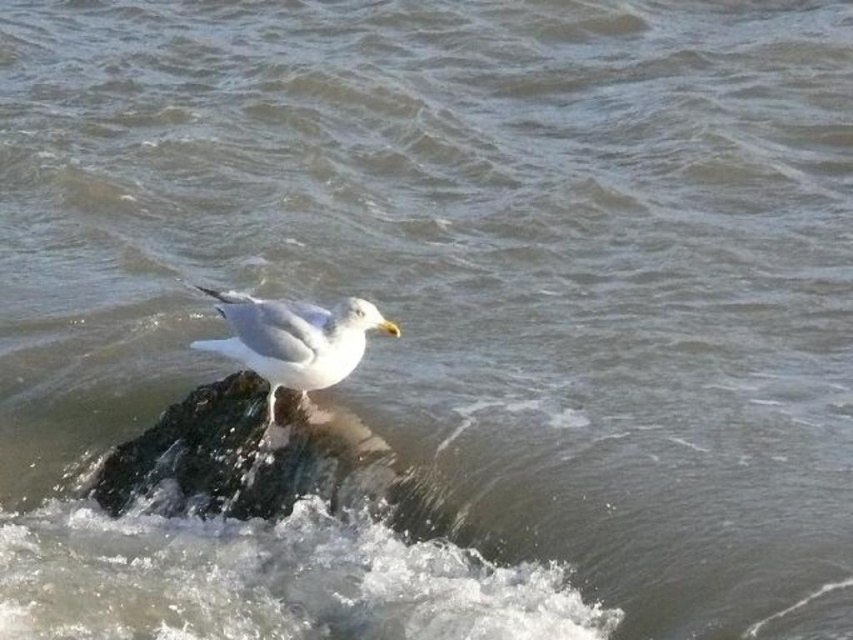
You are a wildlife photographer trying to capture a photo of the white feathered bird at center. To avoid disturbing it, you need to stay on the rough textured rock at center. Is the bird positioned above the rock where you are standing?

The rough textured rock at center is below the white feathered bird at center, so yes, the bird is positioned above the rock where you are standing.

You are a photographer trying to capture the white feathered bird at center. You notice the rough textured rock at center in the background. Since you want the bird to look larger in the photo, should you move closer to the bird or stay further back?

To make the white feathered bird at center appear larger in the photo, you should move closer to the bird. Moving closer will magnify the bird in the frame, while keeping the rough textured rock at center in the background will help emphasize the bird despite the rock being physically larger.

You are a photographer trying to capture the seagull on the rough textured rock at center. To ensure the rock is centered in your shot, where should you position the camera relative to the rock?

The rough textured rock at center is located at point (242, 454) in 2D coordinates, so you should position the camera directly in front of the rock at that coordinate point to center it in the shot.